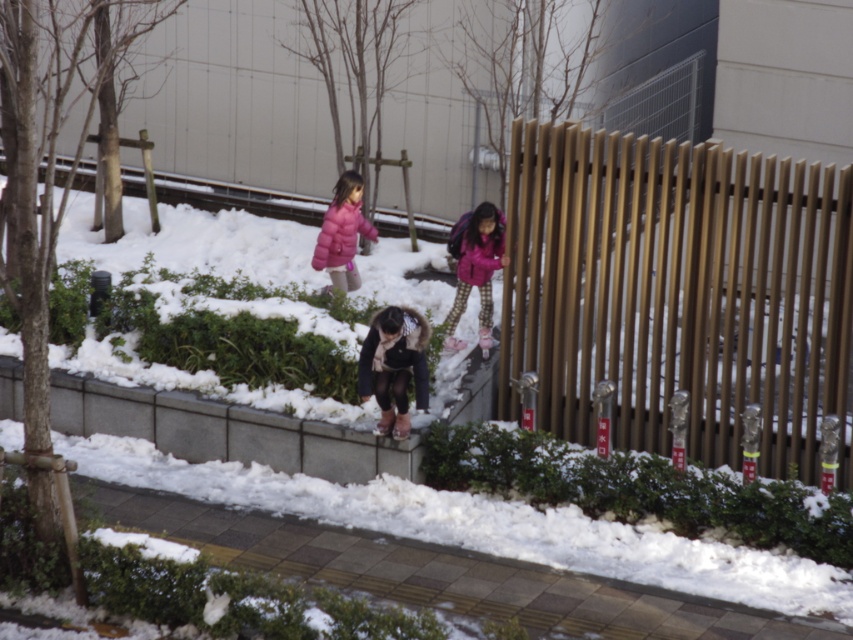
Can you confirm if brown wooden fence at right is thinner than pink matte coat at upper center?

In fact, brown wooden fence at right might be wider than pink matte coat at upper center.

Between brown wooden fence at right and pink matte coat at upper center, which one is positioned lower?

brown wooden fence at right is lower down.

Who is more forward, (579, 154) or (462, 253)?

Point (579, 154) is in front.

Identify the location of brown wooden fence at right. 677,292.

Between matte black jacket at center and pink matte coat at upper center, which one is positioned higher?

pink matte coat at upper center is above.

Can you confirm if matte black jacket at center is positioned to the left of pink matte coat at upper center?

Correct, you'll find matte black jacket at center to the left of pink matte coat at upper center.

Find the location of a particular element. The image size is (853, 640). matte black jacket at center is located at coordinates (393, 365).

From the picture: Does matte pink jacket at center have a lesser width compared to pink matte coat at upper center?

No.

Does point (490, 260) come in front of point (461, 228)?

Yes, point (490, 260) is in front of point (461, 228).

The image size is (853, 640). What are the coordinates of `matte pink jacket at center` in the screenshot? It's located at (477, 272).